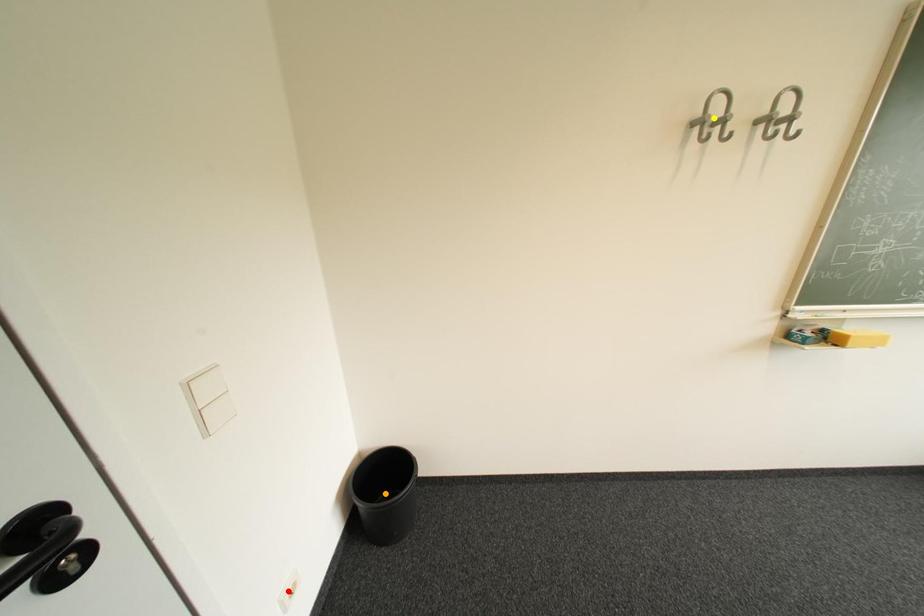
Order these from nearest to farthest:
red point
yellow point
orange point

red point
yellow point
orange point